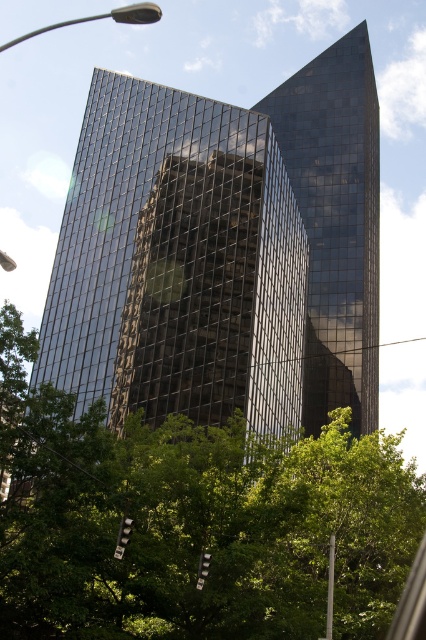
Question: Does green leafy tree at lower center appear on the left side of glossy glass building at center?

Choices:
 (A) no
 (B) yes

Answer: (B)

Question: Among these objects, which one is farthest from the camera?

Choices:
 (A) green leafy tree at lower center
 (B) shiny glass building at center

Answer: (B)

Question: Can you confirm if shiny glass building at center is positioned below green leafy tree at lower center?

Choices:
 (A) yes
 (B) no

Answer: (B)

Question: Does shiny glass building at center have a lesser width compared to glossy glass building at center?

Choices:
 (A) no
 (B) yes

Answer: (A)

Question: Which object is the closest to the glossy glass building at center?

Choices:
 (A) green leafy tree at lower center
 (B) shiny glass building at center

Answer: (B)

Question: Which object is positioned farthest from the green leafy tree at lower center?

Choices:
 (A) glossy glass building at center
 (B) shiny glass building at center

Answer: (A)